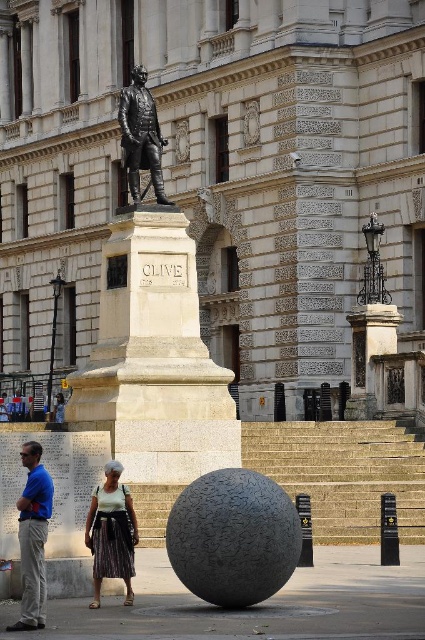
Question: Among these objects, which one is nearest to the camera?

Choices:
 (A) blue shirt at lower left
 (B) bronze statue at center

Answer: (A)

Question: Does blue shirt at lower left appear on the right side of bronze statue at center?

Choices:
 (A) yes
 (B) no

Answer: (B)

Question: Which of the following is the farthest from the observer?

Choices:
 (A) white textured blouse at lower center
 (B) blue shirt at lower left
 (C) polished bronze statue at center
 (D) bronze statue at center

Answer: (D)

Question: From the image, what is the correct spatial relationship of blue shirt at lower left in relation to bronze statue at center?

Choices:
 (A) right
 (B) left

Answer: (B)

Question: Which point appears closest to the camera in this image?

Choices:
 (A) (221, 369)
 (B) (40, 620)
 (C) (132, 99)
 (D) (107, 506)

Answer: (B)

Question: Is polished bronze statue at center bigger than blue shirt at lower left?

Choices:
 (A) yes
 (B) no

Answer: (A)